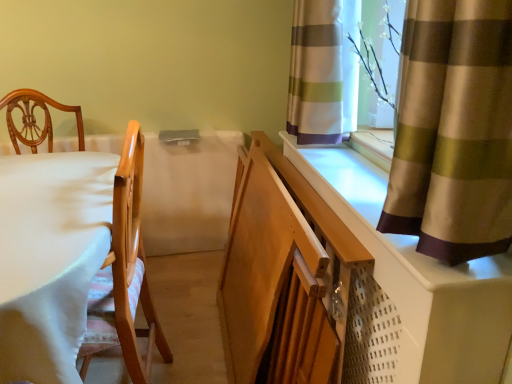
Question: Is striped fabric curtain at upper right, the 2th curtain in the front-to-back sequence, facing towards white fabric table at left?

Choices:
 (A) yes
 (B) no

Answer: (B)

Question: Is white fabric table at left inside striped fabric curtain at upper right, the 2th curtain in the front-to-back sequence?

Choices:
 (A) no
 (B) yes

Answer: (A)

Question: Is striped fabric curtain at upper right, the first curtain in the back-to-front sequence, positioned behind white fabric table at left?

Choices:
 (A) yes
 (B) no

Answer: (A)

Question: Can you confirm if striped fabric curtain at upper right, the first curtain in the back-to-front sequence, is shorter than white fabric table at left?

Choices:
 (A) no
 (B) yes

Answer: (B)

Question: From a real-world perspective, is striped fabric curtain at upper right, the first curtain in the back-to-front sequence, below white fabric table at left?

Choices:
 (A) no
 (B) yes

Answer: (A)

Question: Considering the relative sizes of striped fabric curtain at upper right, the first curtain in the back-to-front sequence, and white fabric table at left in the image provided, is striped fabric curtain at upper right, the first curtain in the back-to-front sequence, bigger than white fabric table at left?

Choices:
 (A) yes
 (B) no

Answer: (B)

Question: From the image's perspective, is white plastic radiator at right located beneath striped fabric curtain at upper right, the first curtain in the back-to-front sequence?

Choices:
 (A) yes
 (B) no

Answer: (A)

Question: Does white plastic radiator at right have a lesser width compared to striped fabric curtain at upper right, the 2th curtain in the front-to-back sequence?

Choices:
 (A) no
 (B) yes

Answer: (A)

Question: Is striped fabric curtain at upper right, the first curtain in the back-to-front sequence, a part of white plastic radiator at right?

Choices:
 (A) yes
 (B) no

Answer: (B)

Question: From a real-world perspective, does white plastic radiator at right stand above striped fabric curtain at upper right, the 2th curtain in the front-to-back sequence?

Choices:
 (A) no
 (B) yes

Answer: (A)

Question: Considering the relative positions of white plastic radiator at right and striped fabric curtain at upper right, the first curtain in the back-to-front sequence, in the image provided, is white plastic radiator at right to the right of striped fabric curtain at upper right, the first curtain in the back-to-front sequence, from the viewer's perspective?

Choices:
 (A) no
 (B) yes

Answer: (B)

Question: Is white plastic radiator at right bigger than striped fabric curtain at upper right, the first curtain in the back-to-front sequence?

Choices:
 (A) no
 (B) yes

Answer: (B)

Question: Is the position of white fabric table at left more distant than that of silky brown curtain at upper right, arranged as the second curtain when viewed from the back?

Choices:
 (A) yes
 (B) no

Answer: (A)